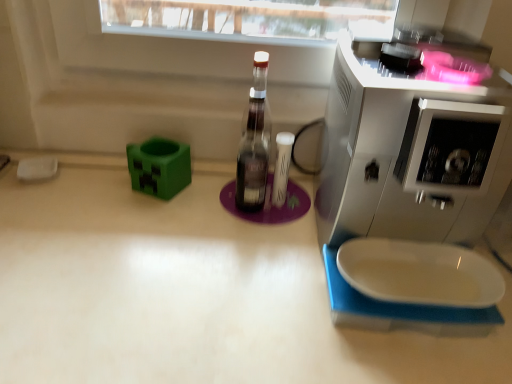
You are a GUI agent. You are given a task and a screenshot of the screen. Output one action in this format:
    pyautogui.click(x=<x>, y=<y>)
    Task: Click on the vacant area on top of white matte countertop at center (from a real-world perspective)
    
    Given the screenshot: What is the action you would take?
    [214, 264]